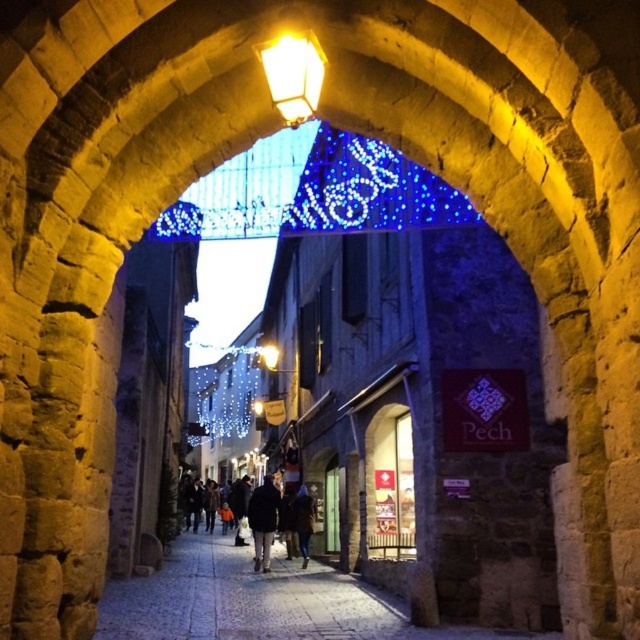
You are standing at the entrance of the smooth stone alley at center and want to reach the yellow glass streetlight at upper center. Which direction should you move to get closer to the streetlight?

To reach the yellow glass streetlight at upper center, you should move upward since the smooth stone alley at center is below the streetlight.